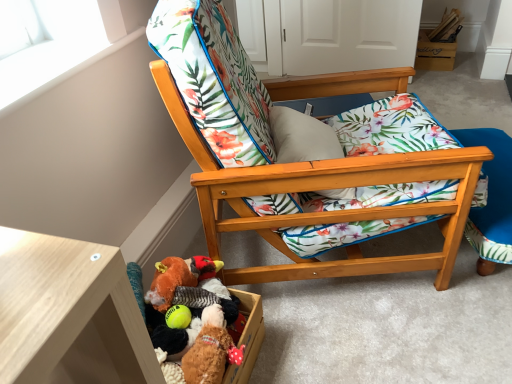
Where is `free space in front of wooden chair with floral cushion at center`? The image size is (512, 384). free space in front of wooden chair with floral cushion at center is located at coordinates [378, 336].